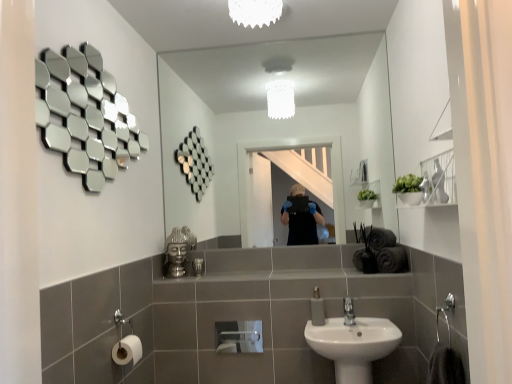
Question: Is clear glass mirror at center, which is the 2th mirror from left to right, at the right side of white matte toilet paper at lower left, which is the 2th toilet paper from front to back?

Choices:
 (A) no
 (B) yes

Answer: (B)

Question: Is clear glass mirror at center, which is the 2th mirror from left to right, to the left of white matte toilet paper at lower left, which is counted as the 2th toilet paper, starting from the left, from the viewer's perspective?

Choices:
 (A) no
 (B) yes

Answer: (A)

Question: Is clear glass mirror at center, which is counted as the 1th mirror, starting from the back, oriented away from white matte toilet paper at lower left, the first toilet paper from the back?

Choices:
 (A) no
 (B) yes

Answer: (A)

Question: From a real-world perspective, does clear glass mirror at center, which is counted as the 1th mirror, starting from the back, sit lower than white matte toilet paper at lower left, which is the 2th toilet paper from front to back?

Choices:
 (A) no
 (B) yes

Answer: (A)

Question: From the image's perspective, is clear glass mirror at center, which is counted as the 1th mirror, starting from the back, located above white matte toilet paper at lower left, which is counted as the 2th toilet paper, starting from the left?

Choices:
 (A) yes
 (B) no

Answer: (A)

Question: Considering the relative sizes of clear glass mirror at center, the second mirror viewed from the front, and white matte toilet paper at lower left, which is counted as the 2th toilet paper, starting from the left, in the image provided, is clear glass mirror at center, the second mirror viewed from the front, bigger than white matte toilet paper at lower left, which is counted as the 2th toilet paper, starting from the left,?

Choices:
 (A) no
 (B) yes

Answer: (B)

Question: Is white matte toilet paper at lower left, which ranks as the 2th toilet paper in back-to-front order, far from clear glass mirror at center, which is counted as the 1th mirror, starting from the back?

Choices:
 (A) no
 (B) yes

Answer: (B)

Question: From a real-world perspective, does white matte toilet paper at lower left, the 1th toilet paper positioned from the left, sit lower than clear glass mirror at center, which is counted as the 1th mirror, starting from the back?

Choices:
 (A) no
 (B) yes

Answer: (B)

Question: Does white matte toilet paper at lower left, which ranks as the second toilet paper in right-to-left order, have a smaller size compared to clear glass mirror at center, the second mirror viewed from the front?

Choices:
 (A) yes
 (B) no

Answer: (A)

Question: Is white matte toilet paper at lower left, the 1th toilet paper positioned from the left, at the left side of clear glass mirror at center, the second mirror viewed from the front?

Choices:
 (A) yes
 (B) no

Answer: (A)

Question: Is white matte toilet paper at lower left, which ranks as the 2th toilet paper in back-to-front order, positioned in front of clear glass mirror at center, the first mirror viewed from the right?

Choices:
 (A) no
 (B) yes

Answer: (B)

Question: Considering the relative sizes of white matte toilet paper at lower left, which ranks as the second toilet paper in right-to-left order, and clear glass mirror at center, the first mirror viewed from the right, in the image provided, is white matte toilet paper at lower left, which ranks as the second toilet paper in right-to-left order, thinner than clear glass mirror at center, the first mirror viewed from the right,?

Choices:
 (A) no
 (B) yes

Answer: (A)

Question: From a real-world perspective, is shiny metallic hexagons at upper left, marked as the second mirror in a right-to-left arrangement, below silver metallic faucet at lower center?

Choices:
 (A) yes
 (B) no

Answer: (B)